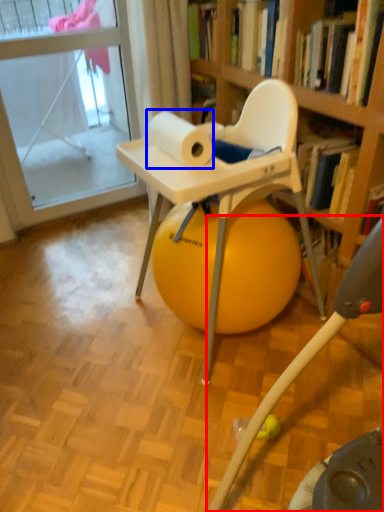
Question: Among these objects, which one is farthest to the camera, feeding chair (highlighted by a red box) or paper towel (highlighted by a blue box)?

Choices:
 (A) feeding chair
 (B) paper towel

Answer: (B)